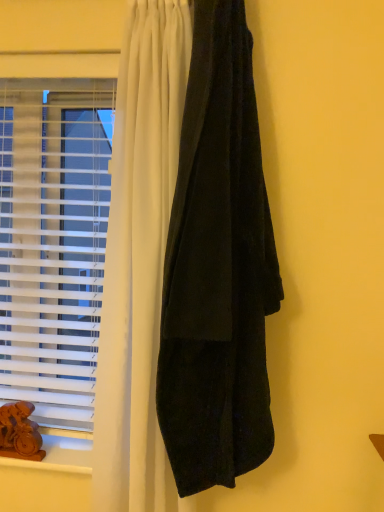
Question: Is velvet black curtain at right at the back of wooden at lower left?

Choices:
 (A) no
 (B) yes

Answer: (A)

Question: Considering the relative sizes of wooden at lower left and velvet black curtain at right in the image provided, is wooden at lower left thinner than velvet black curtain at right?

Choices:
 (A) yes
 (B) no

Answer: (B)

Question: Is wooden at lower left far from velvet black curtain at right?

Choices:
 (A) yes
 (B) no

Answer: (B)

Question: From the image's perspective, is wooden at lower left under velvet black curtain at right?

Choices:
 (A) yes
 (B) no

Answer: (A)

Question: Is wooden at lower left bigger than velvet black curtain at right?

Choices:
 (A) yes
 (B) no

Answer: (B)

Question: Which is correct: velvet black curtain at right is inside brown wooden animal at lower left, or outside of it?

Choices:
 (A) inside
 (B) outside

Answer: (B)

Question: Considering the positions of velvet black curtain at right and brown wooden animal at lower left in the image, is velvet black curtain at right wider or thinner than brown wooden animal at lower left?

Choices:
 (A) wide
 (B) thin

Answer: (A)

Question: Is velvet black curtain at right taller or shorter than brown wooden animal at lower left?

Choices:
 (A) tall
 (B) short

Answer: (A)

Question: From a real-world perspective, is velvet black curtain at right positioned above or below brown wooden animal at lower left?

Choices:
 (A) above
 (B) below

Answer: (A)

Question: Considering the positions of white plastic blinds at left and brown wooden animal at lower left in the image, is white plastic blinds at left bigger or smaller than brown wooden animal at lower left?

Choices:
 (A) big
 (B) small

Answer: (A)

Question: Would you say white plastic blinds at left is inside or outside brown wooden animal at lower left?

Choices:
 (A) inside
 (B) outside

Answer: (B)

Question: Considering their positions, is white plastic blinds at left located in front of or behind brown wooden animal at lower left?

Choices:
 (A) behind
 (B) front

Answer: (B)

Question: Considering the positions of white plastic blinds at left and brown wooden animal at lower left in the image, is white plastic blinds at left wider or thinner than brown wooden animal at lower left?

Choices:
 (A) wide
 (B) thin

Answer: (A)

Question: In the image, is wooden at lower left on the left side or the right side of brown wooden animal at lower left?

Choices:
 (A) right
 (B) left

Answer: (A)

Question: In terms of height, does wooden at lower left look taller or shorter compared to brown wooden animal at lower left?

Choices:
 (A) tall
 (B) short

Answer: (B)